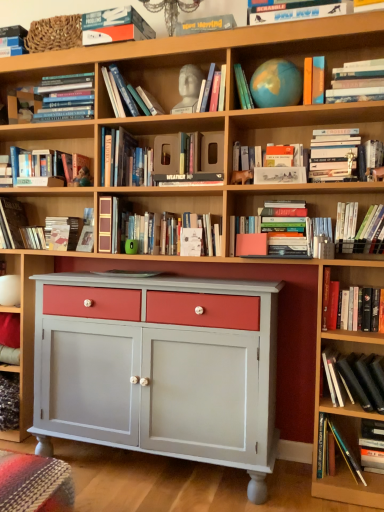
Question: Looking at their shapes, would you say hardcover books at upper center, the fourteenth book in the bottom-to-top sequence, is wider or thinner than white paper at center?

Choices:
 (A) thin
 (B) wide

Answer: (B)

Question: Is point (150, 104) closer or farther from the camera than point (198, 240)?

Choices:
 (A) farther
 (B) closer

Answer: (A)

Question: Which of these objects is positioned closest to the matte blue globe at upper center, which ranks as the eleventh book in bottom-to-top order?

Choices:
 (A) hardcover book at upper right, the seventh book ordered from the bottom
 (B) hardcover book at upper left, the thirteenth book when ordered from bottom to top
 (C) matte black book at upper left, the first book positioned from the top
 (D) hardcover book at left, the eleventh book viewed from the top
 (E) hardcover book at lower right, positioned as the first book in bottom-to-top order

Answer: (A)

Question: Which of these objects is positioned closest to the hardcover book at left, which is the 6th book in bottom-to-top order?

Choices:
 (A) hardcover book at lower right, placed as the sixteenth book when sorted from top to bottom
 (B) hardcover book at upper center, placed as the 8th book when sorted from bottom to top
 (C) orange matte book at upper right, the tenth book from the bottom
 (D) black matte book at lower right, the fourteenth book viewed from the top
 (E) hardcover books at upper right, the 12th book when ordered from top to bottom

Answer: (B)